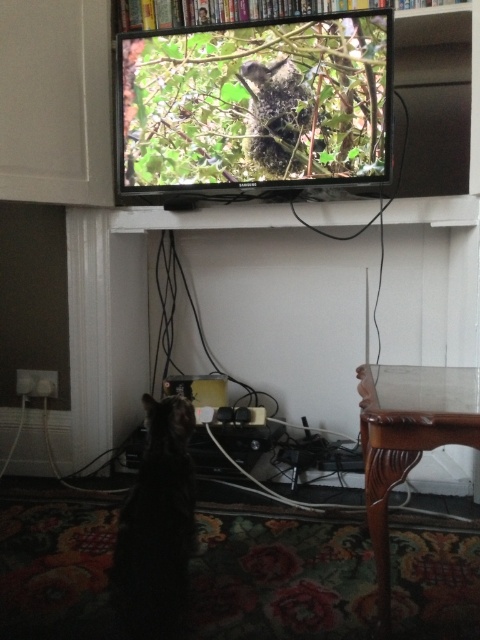
Does mahogany wood table at lower right lie behind black fur cat at lower left?

No, it is not.

Is mahogany wood table at lower right below black fur cat at lower left?

No.

Does point (385, 397) come in front of point (151, 477)?

Yes, it is.

The width and height of the screenshot is (480, 640). I want to click on mahogany wood table at lower right, so click(408, 438).

Is point (173, 593) behind point (165, 22)?

That is False.

This screenshot has height=640, width=480. What do you see at coordinates (157, 512) in the screenshot? I see `black fur cat at lower left` at bounding box center [157, 512].

Image resolution: width=480 pixels, height=640 pixels. What are the coordinates of `black fur cat at lower left` in the screenshot? It's located at (157, 512).

Does mahogany wood table at lower right appear over wooden bookshelf at upper center?

Actually, mahogany wood table at lower right is below wooden bookshelf at upper center.

Between mahogany wood table at lower right and wooden bookshelf at upper center, which one appears on the right side from the viewer's perspective?

mahogany wood table at lower right

Locate an element on the screen. The height and width of the screenshot is (640, 480). mahogany wood table at lower right is located at coordinates (408, 438).